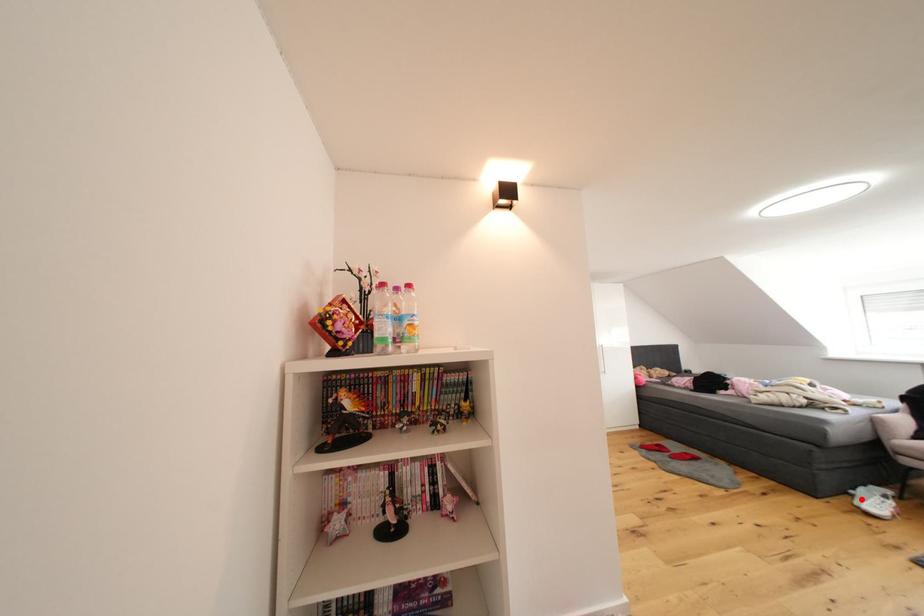
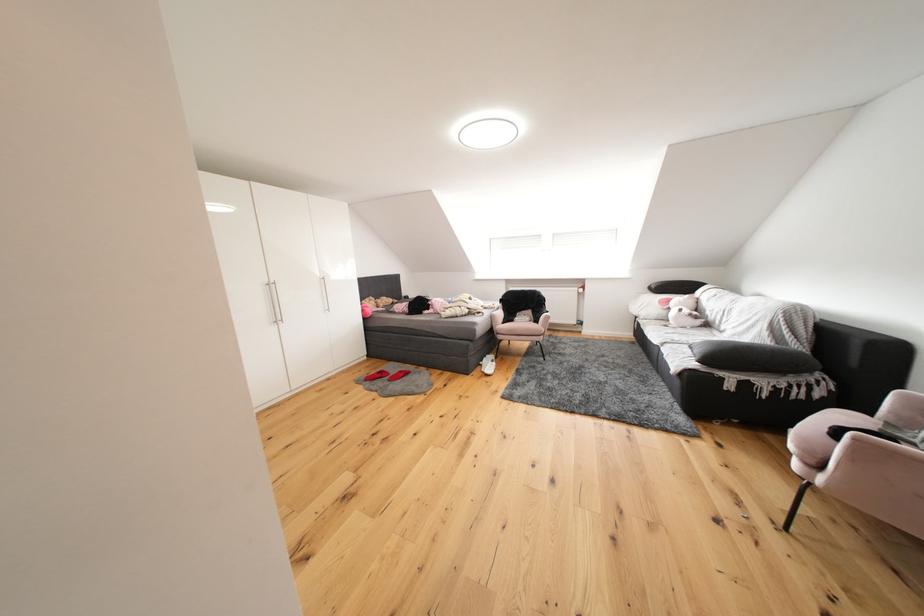
Locate, in the second image, the point that corresponds to the highlighted location in the first image.

(490, 369)